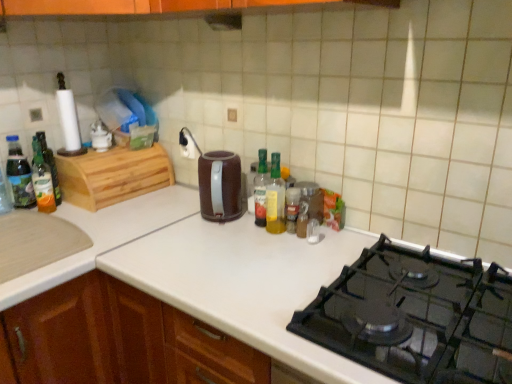
Question: Considering the relative positions of brown matte electric kettle at center and translucent plastic bottle at center, the fifth bottle from the left, in the image provided, is brown matte electric kettle at center to the left of translucent plastic bottle at center, the fifth bottle from the left, from the viewer's perspective?

Choices:
 (A) yes
 (B) no

Answer: (A)

Question: Is brown matte electric kettle at center completely or partially outside of translucent plastic bottle at center, the 1th bottle from the right?

Choices:
 (A) no
 (B) yes

Answer: (B)

Question: From a real-world perspective, is brown matte electric kettle at center under translucent plastic bottle at center, the 1th bottle from the right?

Choices:
 (A) yes
 (B) no

Answer: (B)

Question: Is the position of brown matte electric kettle at center more distant than that of translucent plastic bottle at center, the fifth bottle from the left?

Choices:
 (A) yes
 (B) no

Answer: (B)

Question: Is translucent plastic bottle at center, the 1th bottle from the right, at the back of brown matte electric kettle at center?

Choices:
 (A) yes
 (B) no

Answer: (B)

Question: Is brown matte electric kettle at center not near translucent plastic bottle at center, the fifth bottle from the left?

Choices:
 (A) no
 (B) yes

Answer: (A)

Question: Considering the relative sizes of translucent plastic bottle at center, positioned as the third bottle in right-to-left order, and translucent glass bottle at left, the 4th bottle in the right-to-left sequence, in the image provided, is translucent plastic bottle at center, positioned as the third bottle in right-to-left order, wider than translucent glass bottle at left, the 4th bottle in the right-to-left sequence,?

Choices:
 (A) no
 (B) yes

Answer: (A)

Question: Is translucent plastic bottle at center, positioned as the third bottle in right-to-left order, at the right side of translucent glass bottle at left, the 4th bottle in the right-to-left sequence?

Choices:
 (A) no
 (B) yes

Answer: (B)

Question: Is translucent plastic bottle at center, positioned as the third bottle in right-to-left order, smaller than translucent glass bottle at left, placed as the 2th bottle when sorted from left to right?

Choices:
 (A) no
 (B) yes

Answer: (B)

Question: Does translucent plastic bottle at center, positioned as the third bottle in right-to-left order, have a greater height compared to translucent glass bottle at left, the 4th bottle in the right-to-left sequence?

Choices:
 (A) no
 (B) yes

Answer: (A)

Question: Is translucent plastic bottle at center, the third bottle when ordered from left to right, far away from translucent glass bottle at left, placed as the 2th bottle when sorted from left to right?

Choices:
 (A) yes
 (B) no

Answer: (B)

Question: From the image's perspective, is translucent plastic bottle at center, positioned as the third bottle in right-to-left order, on translucent glass bottle at left, placed as the 2th bottle when sorted from left to right?

Choices:
 (A) yes
 (B) no

Answer: (B)

Question: Can you confirm if brown matte electric kettle at center is taller than black matte gas stove at lower right?

Choices:
 (A) yes
 (B) no

Answer: (A)